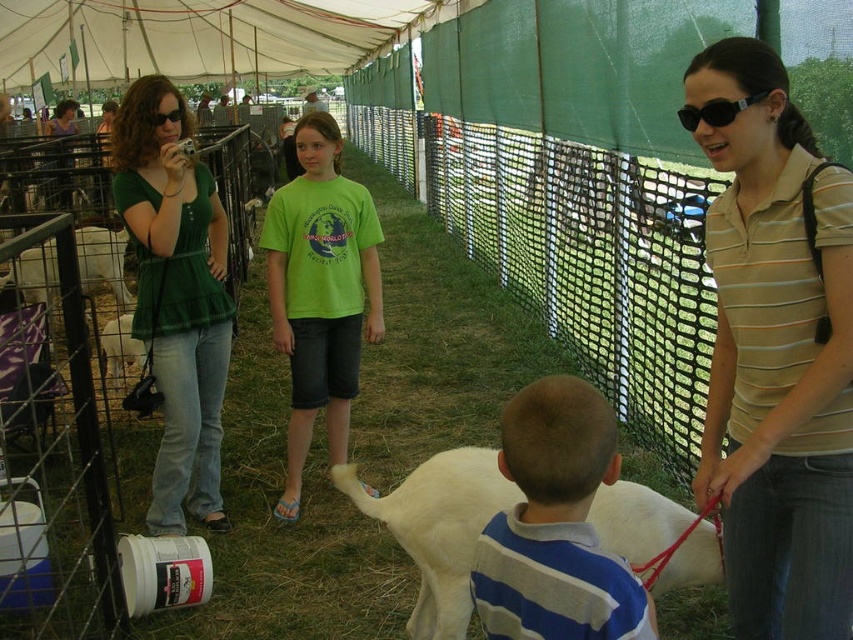
Is beige striped shirt at center right shorter than black plastic goggles at upper center?

Incorrect, beige striped shirt at center right's height does not fall short of black plastic goggles at upper center's.

The width and height of the screenshot is (853, 640). In order to click on beige striped shirt at center right in this screenshot , I will do `click(776, 356)`.

You are a GUI agent. You are given a task and a screenshot of the screen. Output one action in this format:
    pyautogui.click(x=<x>, y=<y>)
    Task: Click on the beige striped shirt at center right
    
    Given the screenshot: What is the action you would take?
    pyautogui.click(x=776, y=356)

Is point (131, 3) behind point (738, 112)?

Yes, point (131, 3) is behind point (738, 112).

Can you confirm if white canvas tent at upper center is positioned to the left of black plastic goggles at upper center?

Indeed, white canvas tent at upper center is positioned on the left side of black plastic goggles at upper center.

Between point (119, 64) and point (752, 99), which one is positioned in front?

Point (752, 99) is in front.

Where is `white canvas tent at upper center`? The width and height of the screenshot is (853, 640). white canvas tent at upper center is located at coordinates coord(190,36).

Where is `green cotton shirt at center`? green cotton shirt at center is located at coordinates (320, 291).

Does green cotton shirt at center appear on the left side of white woolen goat at center?

Yes, green cotton shirt at center is to the left of white woolen goat at center.

Locate an element on the screen. This screenshot has width=853, height=640. green cotton shirt at center is located at coordinates (x=320, y=291).

This screenshot has height=640, width=853. Identify the location of green cotton shirt at center. click(320, 291).